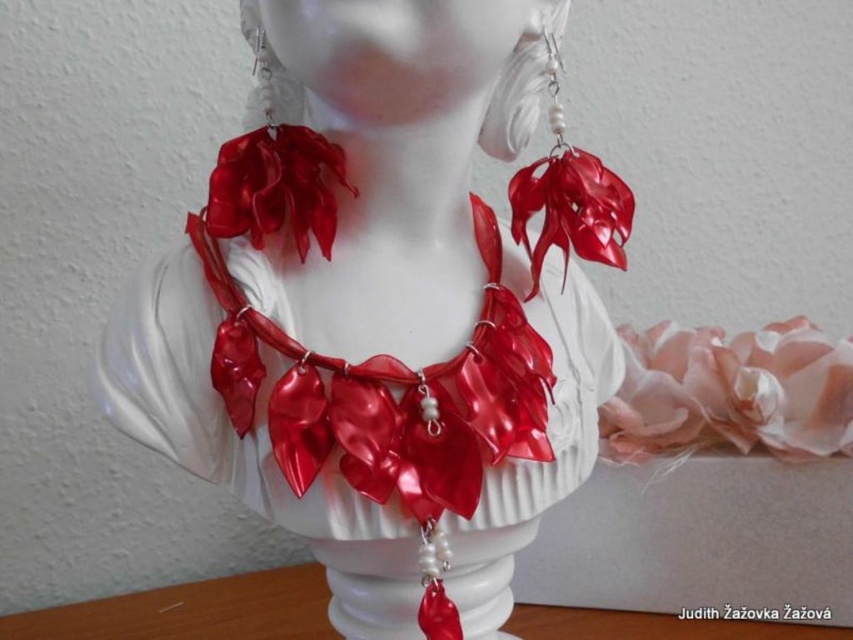
Question: Which of the following is the farthest from the observer?

Choices:
 (A) glossy plastic necklace at center
 (B) pink satin flower at center
 (C) shiny red fabric at center
 (D) shiny red leaves at center

Answer: (B)

Question: Is shiny red ribbon at center wider than glossy plastic necklace at center?

Choices:
 (A) yes
 (B) no

Answer: (B)

Question: Which point is farther to the camera?

Choices:
 (A) (247, 134)
 (B) (534, 211)
 (C) (364, 38)

Answer: (B)

Question: From the image, what is the correct spatial relationship of shiny red ribbon at center in relation to glossy plastic necklace at center?

Choices:
 (A) below
 (B) above

Answer: (A)

Question: Which object is positioned closest to the pink satin flower at center?

Choices:
 (A) shiny red ribbon at center
 (B) glossy plastic flower at upper right

Answer: (B)

Question: Can you confirm if shiny red ribbon at center is bigger than glossy plastic necklace at center?

Choices:
 (A) yes
 (B) no

Answer: (B)